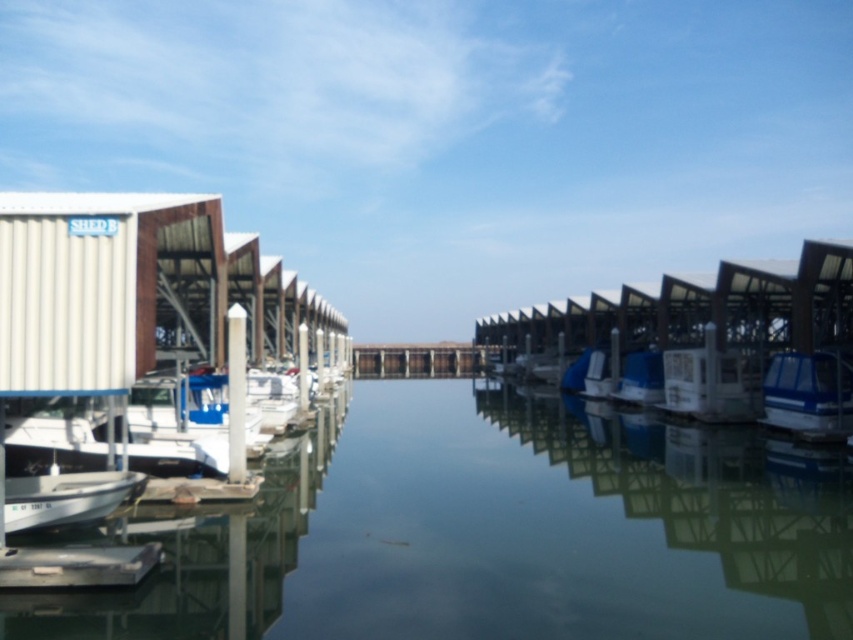
Who is more forward, (776, 388) or (476, 365)?

Positioned in front is point (776, 388).

Does blue glossy boat at center have a smaller size compared to brown wooden dock at center?

Yes, blue glossy boat at center is smaller than brown wooden dock at center.

What do you see at coordinates (808, 394) in the screenshot? This screenshot has width=853, height=640. I see `blue glossy boat at center` at bounding box center [808, 394].

Locate an element on the screen. Image resolution: width=853 pixels, height=640 pixels. blue glossy boat at center is located at coordinates (808, 394).

Is clear glass water at center to the left of blue glossy boat at center from the viewer's perspective?

Indeed, clear glass water at center is positioned on the left side of blue glossy boat at center.

Which is in front, point (149, 593) or point (788, 396)?

Point (149, 593) is more forward.

At what (x,y) coordinates should I click in order to perform the action: click on clear glass water at center. Please return your answer as a coordinate pair (x, y). The image size is (853, 640). Looking at the image, I should click on [543, 524].

Does clear glass water at center have a larger size compared to white glossy boat at center?

Yes, clear glass water at center is bigger than white glossy boat at center.

Is clear glass water at center to the right of white glossy boat at center from the viewer's perspective?

In fact, clear glass water at center is to the left of white glossy boat at center.

Describe the element at coordinates (543, 524) in the screenshot. The height and width of the screenshot is (640, 853). I see `clear glass water at center` at that location.

Locate an element on the screen. This screenshot has height=640, width=853. clear glass water at center is located at coordinates (543, 524).